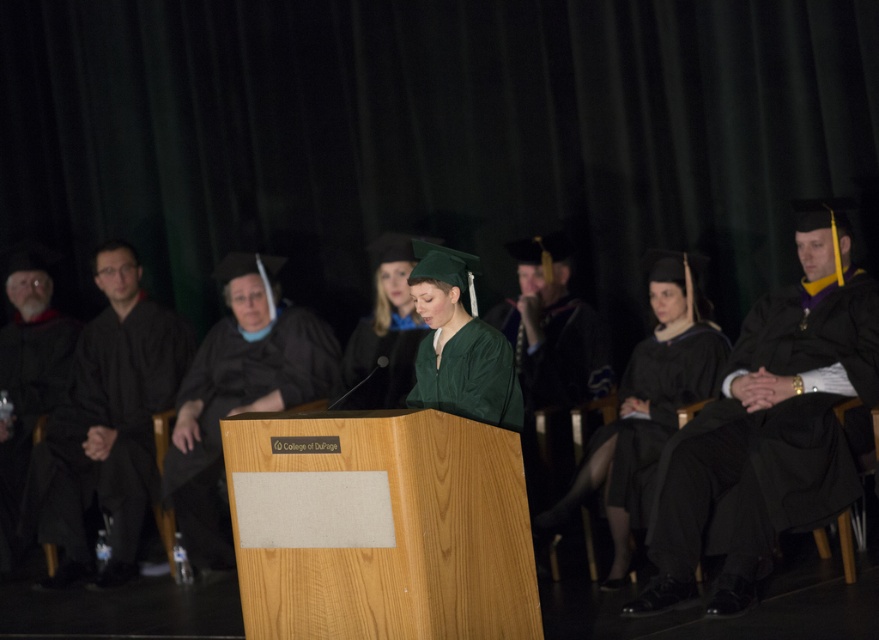
Question: Which object is farther from the camera taking this photo?

Choices:
 (A) black matte graduation gown at left
 (B) black matte graduation gown at right
 (C) black matte graduation gown at center

Answer: (A)

Question: Can you confirm if black matte graduation gown at center is positioned to the left of green matte graduation gown at center?

Choices:
 (A) no
 (B) yes

Answer: (A)

Question: Is matte black graduation gown at center positioned in front of green matte graduation gown at center?

Choices:
 (A) no
 (B) yes

Answer: (A)

Question: Can you confirm if black matte graduation gown at center is smaller than green velvet graduation gown at center?

Choices:
 (A) yes
 (B) no

Answer: (B)

Question: Which point is farther to the camera?

Choices:
 (A) (459, 314)
 (B) (721, 342)
 (C) (821, 289)
 (D) (164, 467)

Answer: (D)

Question: Which of the following is the farthest from the observer?

Choices:
 (A) (129, 296)
 (B) (741, 572)
 (C) (433, 388)

Answer: (A)